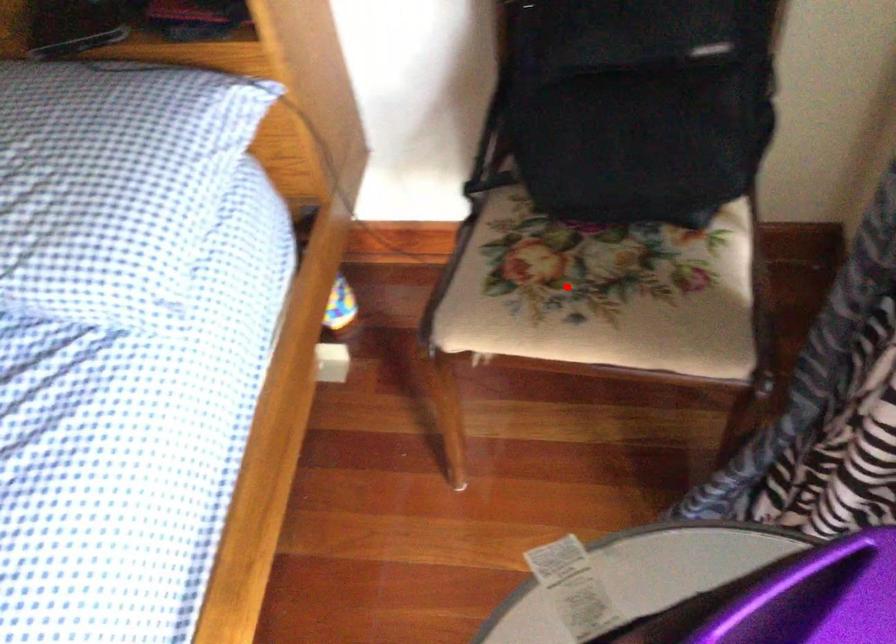
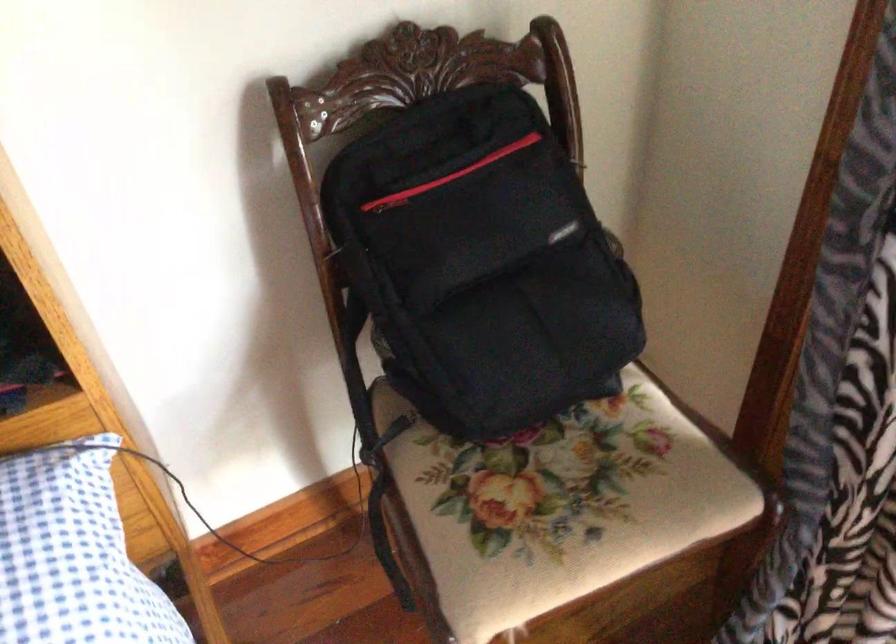
Question: I am providing you with two images of the same scene from different viewpoints. In image1, a red point is highlighted. Considering the same 3D point in image2, which of the following is correct?

Choices:
 (A) It is closer
 (B) It is farther

Answer: (A)